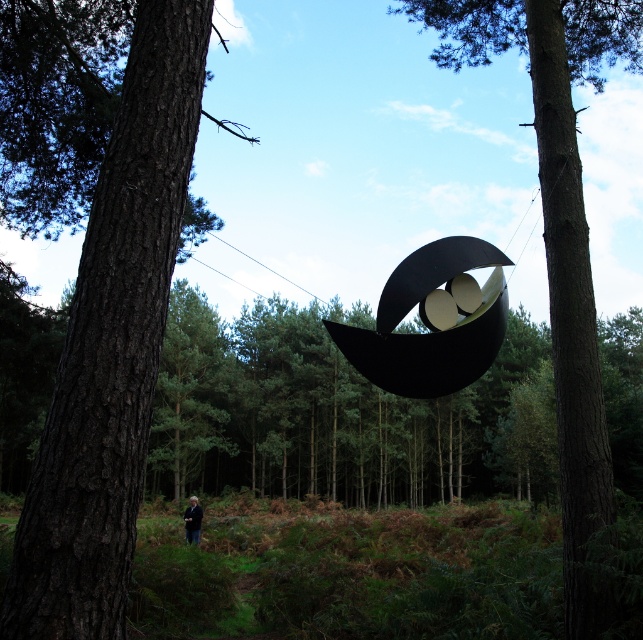
You are standing in the forest and see two points in the scene. The first point is at coordinates point (113,209) and the second is at point (194,529). Which point is closer to you?

Point (113,209) is in front of point (194,529), so it is closer to you.

You are standing in the forest and want to take a photo of the smooth brown tree trunk at center. According to the coordinates provided, where should you position yourself to capture the trunk in the center of your camera view?

To capture the smooth brown tree trunk at center in the center of your camera view, position yourself so that the camera is aimed directly at the coordinates point (561, 252), which is the 2D location of the smooth brown tree trunk at center.

In the scene shown: You are standing in the forest and see the dark brown textured tree trunk at left and the black fabric person at lower center. Which object is located to the right of the other?

The dark brown textured tree trunk at left is positioned on the right side of black fabric person at lower center.